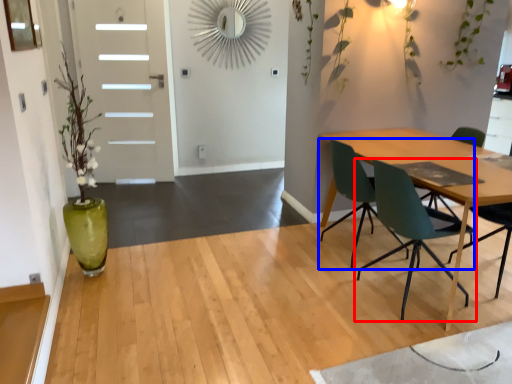
Question: Which object is closer to the camera taking this photo, chair (highlighted by a red box) or chair (highlighted by a blue box)?

Choices:
 (A) chair
 (B) chair

Answer: (A)